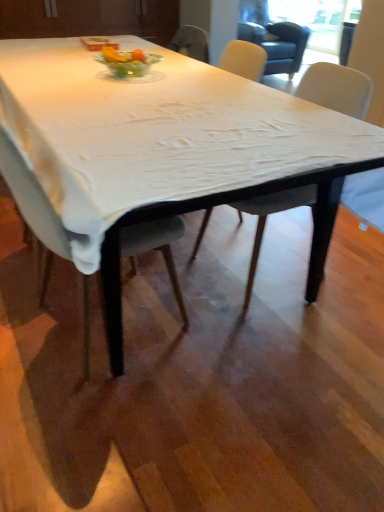
Identify the location of vacant area that is situated to the right of white fabric chair at center, which is the first chair from right to left. The image size is (384, 512). (349, 268).